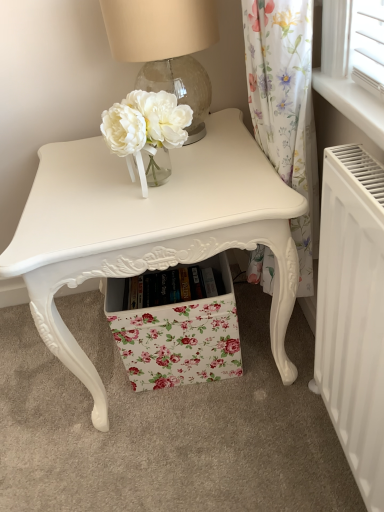
The width and height of the screenshot is (384, 512). I want to click on vacant space in between matte white table at center and white matte radiator at lower right, so click(x=240, y=447).